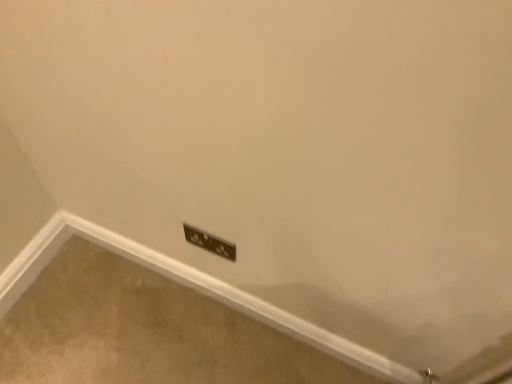
Question: Considering their positions, is black plastic power plugs and sockets at lower center located in front of or behind metallic socket at lower center?

Choices:
 (A) front
 (B) behind

Answer: (A)

Question: Considering the positions of black plastic power plugs and sockets at lower center and metallic socket at lower center in the image, is black plastic power plugs and sockets at lower center wider or thinner than metallic socket at lower center?

Choices:
 (A) wide
 (B) thin

Answer: (B)

Question: From the image's perspective, relative to metallic socket at lower center, is black plastic power plugs and sockets at lower center above or below?

Choices:
 (A) above
 (B) below

Answer: (A)

Question: In terms of size, does metallic socket at lower center appear bigger or smaller than black plastic power plugs and sockets at lower center?

Choices:
 (A) small
 (B) big

Answer: (B)

Question: From the image's perspective, relative to black plastic power plugs and sockets at lower center, is metallic socket at lower center above or below?

Choices:
 (A) above
 (B) below

Answer: (B)

Question: From a real-world perspective, relative to black plastic power plugs and sockets at lower center, is metallic socket at lower center vertically above or below?

Choices:
 (A) below
 (B) above

Answer: (A)

Question: Would you say metallic socket at lower center is inside or outside black plastic power plugs and sockets at lower center?

Choices:
 (A) outside
 (B) inside

Answer: (A)